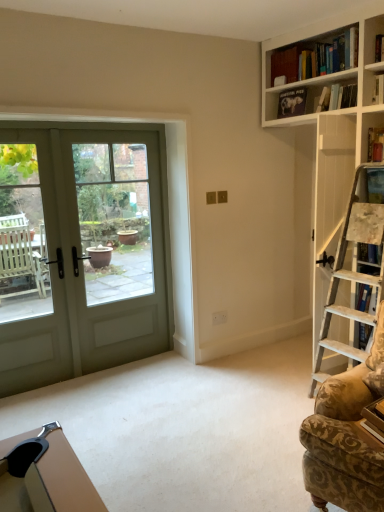
Question: Considering the relative sizes of hardcover book at upper right, acting as the 2th book starting from the left, and matte black book at upper center, which is the 1th book in top-to-bottom order, in the image provided, is hardcover book at upper right, acting as the 2th book starting from the left, wider than matte black book at upper center, which is the 1th book in top-to-bottom order,?

Choices:
 (A) no
 (B) yes

Answer: (B)

Question: Can you confirm if hardcover book at upper right, which appears as the first book when viewed from the right, is positioned to the left of matte black book at upper center, arranged as the 2th book when viewed from the front?

Choices:
 (A) no
 (B) yes

Answer: (A)

Question: Is matte black book at upper center, the 2th book from the bottom, inside hardcover book at upper right, which appears as the first book when viewed from the right?

Choices:
 (A) yes
 (B) no

Answer: (B)

Question: From the image's perspective, is hardcover book at upper right, which ranks as the first book in bottom-to-top order, over matte black book at upper center, arranged as the 2th book when viewed from the front?

Choices:
 (A) yes
 (B) no

Answer: (B)

Question: Could you tell me if hardcover book at upper right, the 1th book positioned from the front, is turned towards matte black book at upper center, which is the 1th book in top-to-bottom order?

Choices:
 (A) yes
 (B) no

Answer: (B)

Question: Choose the correct answer: Is patterned fabric rocking chair at right inside matte black book at upper center, arranged as the 2th book when viewed from the front, or outside it?

Choices:
 (A) outside
 (B) inside

Answer: (A)

Question: Is patterned fabric rocking chair at right to the left or to the right of matte black book at upper center, the second book in the right-to-left sequence, in the image?

Choices:
 (A) left
 (B) right

Answer: (B)

Question: In terms of width, does patterned fabric rocking chair at right look wider or thinner when compared to matte black book at upper center, which is the 1th book in top-to-bottom order?

Choices:
 (A) thin
 (B) wide

Answer: (B)

Question: Relative to matte black book at upper center, which is the 1th book in top-to-bottom order, is patterned fabric rocking chair at right in front or behind?

Choices:
 (A) behind
 (B) front

Answer: (B)

Question: Is point (288, 94) closer or farther from the camera than point (31, 159)?

Choices:
 (A) farther
 (B) closer

Answer: (A)

Question: From the image's perspective, relative to green matte screen door at left, is matte black book at upper center, the second book in the right-to-left sequence, above or below?

Choices:
 (A) below
 (B) above

Answer: (B)

Question: Choose the correct answer: Is matte black book at upper center, which appears as the 1th book when viewed from the back, inside green matte screen door at left or outside it?

Choices:
 (A) outside
 (B) inside

Answer: (A)

Question: Considering their positions, is matte black book at upper center, which appears as the 1th book when viewed from the back, located in front of or behind green matte screen door at left?

Choices:
 (A) behind
 (B) front

Answer: (A)

Question: Based on their positions, is green matte screen door at left located to the left or right of green matte door at left?

Choices:
 (A) left
 (B) right

Answer: (A)

Question: Is green matte screen door at left bigger or smaller than green matte door at left?

Choices:
 (A) small
 (B) big

Answer: (B)